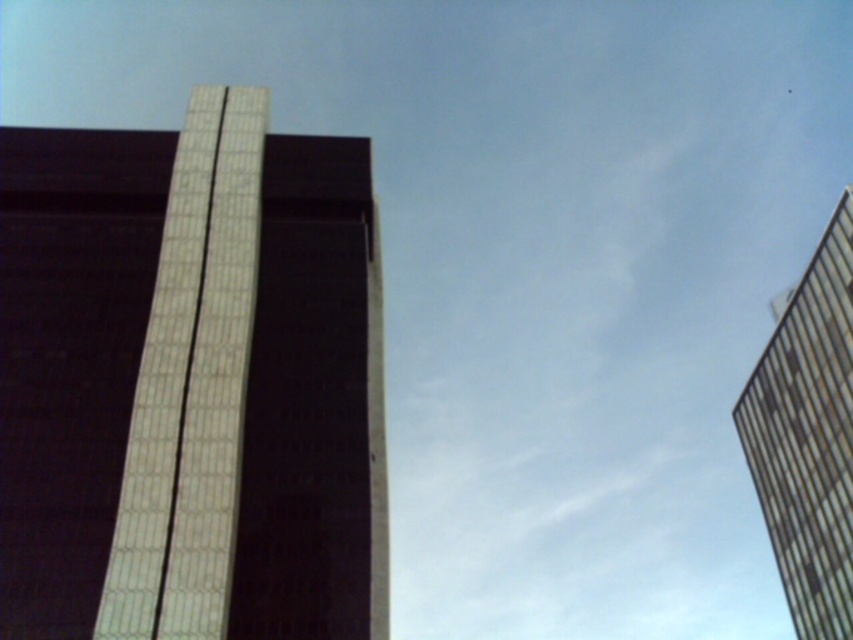
Question: Which point is farther to the camera?

Choices:
 (A) (21, 240)
 (B) (817, 444)

Answer: (B)

Question: Among these points, which one is farthest from the camera?

Choices:
 (A) (795, 483)
 (B) (125, 408)

Answer: (A)

Question: Can you confirm if white textured building at center is thinner than metallic glass tower at right?

Choices:
 (A) no
 (B) yes

Answer: (B)

Question: Does white textured building at center lie behind metallic glass tower at right?

Choices:
 (A) no
 (B) yes

Answer: (A)

Question: From the image, what is the correct spatial relationship of white textured building at center in relation to metallic glass tower at right?

Choices:
 (A) below
 (B) above

Answer: (B)